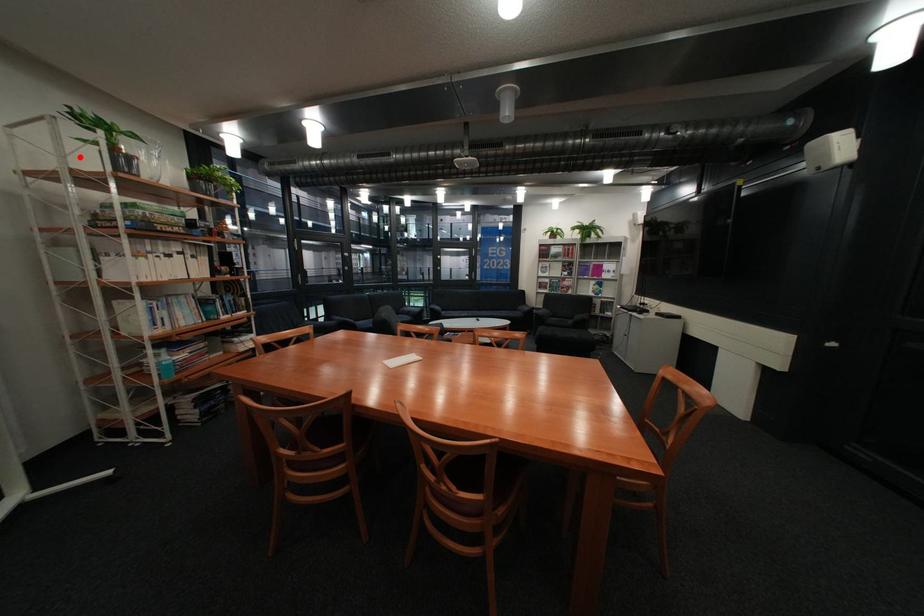
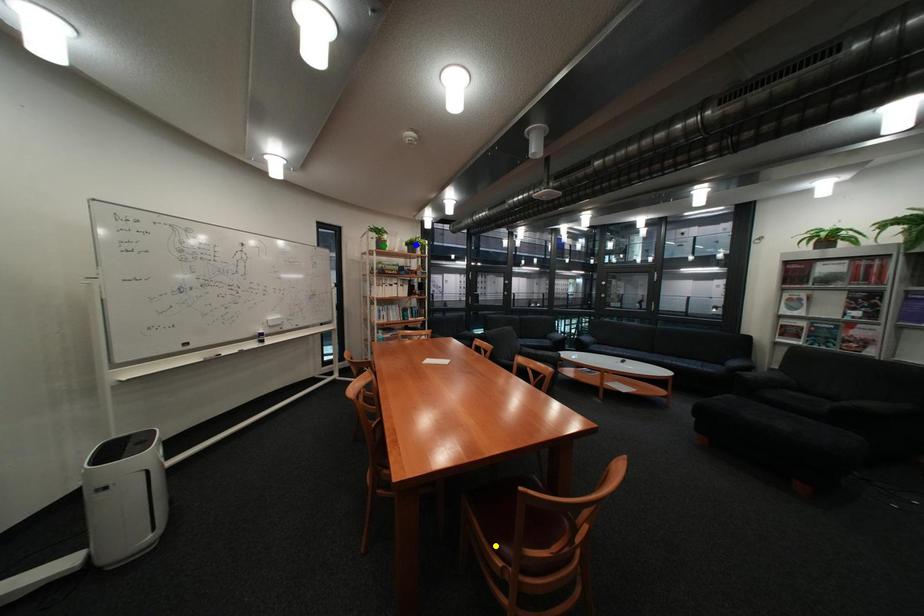
Question: I am providing you with two images of the same scene from different viewpoints. A red point is marked on the first image. You are given multiple points on the second image. Can you choose the point in image 2 that corresponds to the point in image 1?

Choices:
 (A) yellow point
 (B) green point
 (C) blue point

Answer: (B)